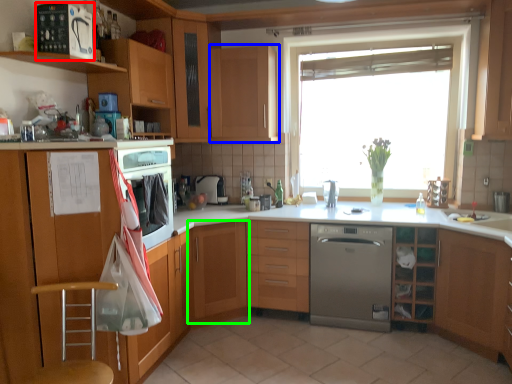
Question: Which object is the farthest from kitchen appliance (highlighted by a red box)? Choose among these: cabinetry (highlighted by a blue box) or cabinetry (highlighted by a green box).

Choices:
 (A) cabinetry
 (B) cabinetry

Answer: (B)